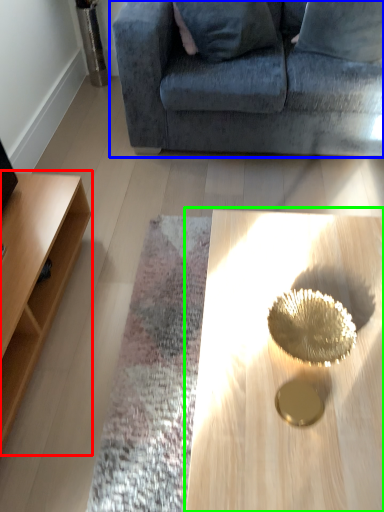
Question: Considering the real-world distances, which object is farthest from table (highlighted by a red box)? studio couch (highlighted by a blue box) or coffee table (highlighted by a green box)?

Choices:
 (A) studio couch
 (B) coffee table

Answer: (A)